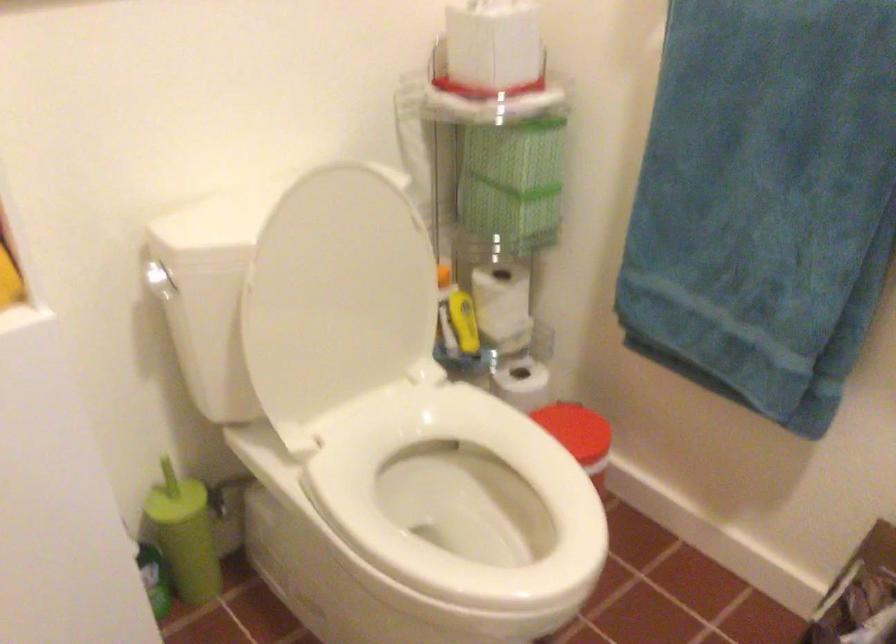
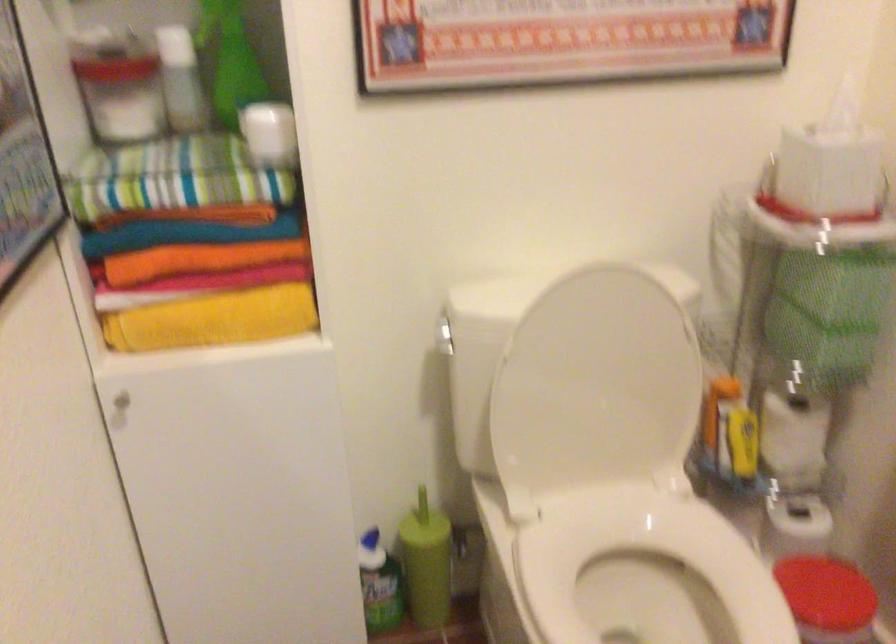
Question: I am providing you with two images of the same scene from different viewpoints. Which of the following objects are not visible in image2?

Choices:
 (A) yellow plastic bottle
 (B) toilet flush handle
 (C) red trash can lid
 (D) none of these

Answer: (D)